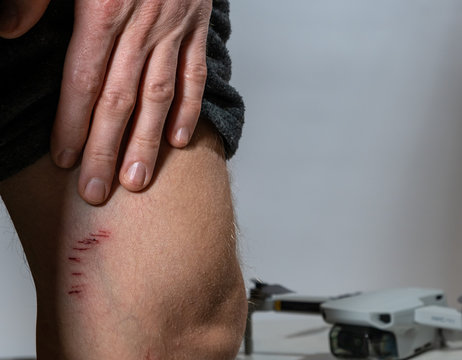
Image resolution: width=462 pixels, height=360 pixels. In order to click on wall in this screenshot , I will do `click(316, 116)`.